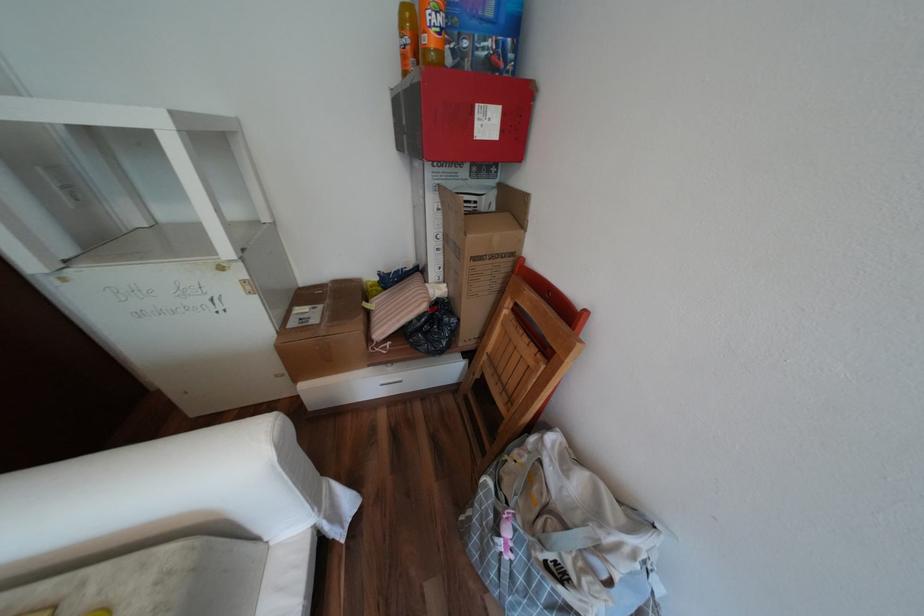
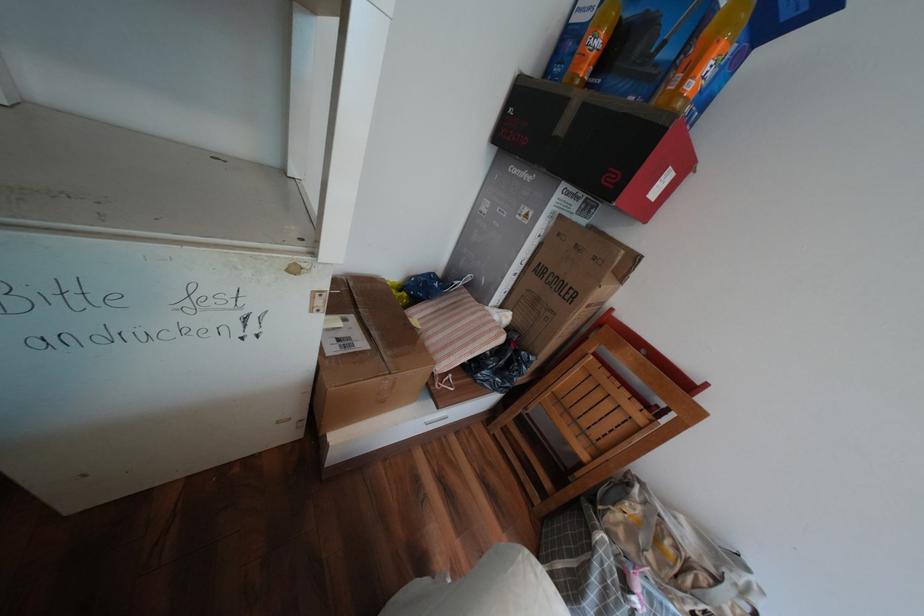
Question: The first image is from the beginning of the video and the second image is from the end. How did the camera likely rotate when shooting the video?

Choices:
 (A) Left
 (B) Right
 (C) Up
 (D) Down

Answer: (B)